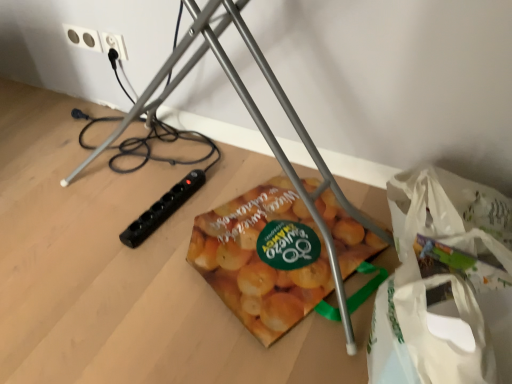
Identify the location of black plastic power plug at upper left, marked as the first power plugs and sockets in a right-to-left arrangement. The height and width of the screenshot is (384, 512). (114, 44).

Image resolution: width=512 pixels, height=384 pixels. In order to click on metallic tripod at center in this screenshot , I will do `click(256, 125)`.

Considering the sizes of objects white plastic power plugs and sockets at upper left, positioned as the 2th power plugs and sockets in right-to-left order, and black plastic power plug at upper left, marked as the first power plugs and sockets in a right-to-left arrangement, in the image provided, who is smaller, white plastic power plugs and sockets at upper left, positioned as the 2th power plugs and sockets in right-to-left order, or black plastic power plug at upper left, marked as the first power plugs and sockets in a right-to-left arrangement,?

Smaller between the two is white plastic power plugs and sockets at upper left, positioned as the 2th power plugs and sockets in right-to-left order.

Which object is positioned more to the left, white plastic power plugs and sockets at upper left, the 1th power plugs and sockets viewed from the left, or black plastic power plug at upper left, acting as the second power plugs and sockets starting from the left?

From the viewer's perspective, white plastic power plugs and sockets at upper left, the 1th power plugs and sockets viewed from the left, appears more on the left side.

Between white plastic power plugs and sockets at upper left, the 1th power plugs and sockets viewed from the left, and black plastic power plug at upper left, acting as the second power plugs and sockets starting from the left, which one has less height?

white plastic power plugs and sockets at upper left, the 1th power plugs and sockets viewed from the left.

Considering the relative sizes of white plastic power plugs and sockets at upper left, the 1th power plugs and sockets viewed from the left, and black plastic power plug at upper left, acting as the second power plugs and sockets starting from the left, in the image provided, is white plastic power plugs and sockets at upper left, the 1th power plugs and sockets viewed from the left, wider than black plastic power plug at upper left, acting as the second power plugs and sockets starting from the left,?

Incorrect, the width of white plastic power plugs and sockets at upper left, the 1th power plugs and sockets viewed from the left, does not surpass that of black plastic power plug at upper left, acting as the second power plugs and sockets starting from the left.

Which is nearer, (110, 38) or (85, 37)?

Clearly, point (110, 38) is closer to the camera than point (85, 37).

Is there a large distance between black plastic power plug at upper left, marked as the first power plugs and sockets in a right-to-left arrangement, and white plastic power plugs and sockets at upper left, the 1th power plugs and sockets viewed from the left?

No, black plastic power plug at upper left, marked as the first power plugs and sockets in a right-to-left arrangement, is not far from white plastic power plugs and sockets at upper left, the 1th power plugs and sockets viewed from the left.

Considering the positions of objects black plastic power plug at upper left, acting as the second power plugs and sockets starting from the left, and white plastic power plugs and sockets at upper left, the 1th power plugs and sockets viewed from the left, in the image provided, who is more to the right, black plastic power plug at upper left, acting as the second power plugs and sockets starting from the left, or white plastic power plugs and sockets at upper left, the 1th power plugs and sockets viewed from the left,?

black plastic power plug at upper left, acting as the second power plugs and sockets starting from the left, is more to the right.

From their relative heights in the image, would you say black plastic power plug at upper left, acting as the second power plugs and sockets starting from the left, is taller or shorter than white plastic power plugs and sockets at upper left, the 1th power plugs and sockets viewed from the left?

In the image, black plastic power plug at upper left, acting as the second power plugs and sockets starting from the left, appears to be taller than white plastic power plugs and sockets at upper left, the 1th power plugs and sockets viewed from the left.

At what (x,y) coordinates should I click in order to perform the action: click on tripod in front of the matte plastic bag of sweet potatoes at center. Please return your answer as a coordinate pair (x, y). Looking at the image, I should click on (256, 125).

Measure the distance from metallic tripod at center to matte plastic bag of sweet potatoes at center.

A distance of 7.91 inches exists between metallic tripod at center and matte plastic bag of sweet potatoes at center.

In terms of width, does metallic tripod at center look wider or thinner when compared to matte plastic bag of sweet potatoes at center?

In the image, metallic tripod at center appears to be wider than matte plastic bag of sweet potatoes at center.

From a real-world perspective, who is located higher, metallic tripod at center or matte plastic bag of sweet potatoes at center?

matte plastic bag of sweet potatoes at center, from a real-world perspective.

From the image's perspective, would you say metallic tripod at center is shown under white plastic power plugs and sockets at upper left, the 1th power plugs and sockets viewed from the left?

Yes.

Is metallic tripod at center oriented away from white plastic power plugs and sockets at upper left, positioned as the 2th power plugs and sockets in right-to-left order?

No.

Where is `tripod lying on the right of white plastic power plugs and sockets at upper left, positioned as the 2th power plugs and sockets in right-to-left order`? The height and width of the screenshot is (384, 512). tripod lying on the right of white plastic power plugs and sockets at upper left, positioned as the 2th power plugs and sockets in right-to-left order is located at coordinates (256, 125).

Can you confirm if metallic tripod at center is shorter than white plastic power plugs and sockets at upper left, positioned as the 2th power plugs and sockets in right-to-left order?

Yes, metallic tripod at center is shorter than white plastic power plugs and sockets at upper left, positioned as the 2th power plugs and sockets in right-to-left order.

From the image's perspective, is white plastic power plugs and sockets at upper left, positioned as the 2th power plugs and sockets in right-to-left order, above or below matte plastic bag of sweet potatoes at center?

Clearly, from the image's perspective, white plastic power plugs and sockets at upper left, positioned as the 2th power plugs and sockets in right-to-left order, is above matte plastic bag of sweet potatoes at center.

Is white plastic power plugs and sockets at upper left, positioned as the 2th power plugs and sockets in right-to-left order, with matte plastic bag of sweet potatoes at center?

No, white plastic power plugs and sockets at upper left, positioned as the 2th power plugs and sockets in right-to-left order, is not touching matte plastic bag of sweet potatoes at center.

Considering the points (77, 31) and (331, 278), which point is behind, point (77, 31) or point (331, 278)?

Point (77, 31)

In terms of size, does white plastic power plugs and sockets at upper left, the 1th power plugs and sockets viewed from the left, appear bigger or smaller than matte plastic bag of sweet potatoes at center?

In the image, white plastic power plugs and sockets at upper left, the 1th power plugs and sockets viewed from the left, appears to be smaller than matte plastic bag of sweet potatoes at center.

Based on their sizes in the image, would you say white plastic bag at lower right is bigger or smaller than metallic tripod at center?

white plastic bag at lower right is smaller than metallic tripod at center.

Who is shorter, white plastic bag at lower right or metallic tripod at center?

metallic tripod at center is shorter.

Is white plastic bag at lower right touching metallic tripod at center?

No, white plastic bag at lower right is not touching metallic tripod at center.

From the image's perspective, is white plastic power plugs and sockets at upper left, the 1th power plugs and sockets viewed from the left, positioned above or below metallic tripod at center?

white plastic power plugs and sockets at upper left, the 1th power plugs and sockets viewed from the left, is situated higher than metallic tripod at center in the image.

Choose the correct answer: Is white plastic power plugs and sockets at upper left, the 1th power plugs and sockets viewed from the left, inside metallic tripod at center or outside it?

white plastic power plugs and sockets at upper left, the 1th power plugs and sockets viewed from the left, is spatially situated outside metallic tripod at center.

Between white plastic power plugs and sockets at upper left, positioned as the 2th power plugs and sockets in right-to-left order, and metallic tripod at center, which one has more height?

With more height is white plastic power plugs and sockets at upper left, positioned as the 2th power plugs and sockets in right-to-left order.

Where is `power plugs and sockets that appears above the black plastic power plug at upper left, acting as the second power plugs and sockets starting from the left (from the image's perspective)`? power plugs and sockets that appears above the black plastic power plug at upper left, acting as the second power plugs and sockets starting from the left (from the image's perspective) is located at coordinates (82, 37).

Identify the location of power plugs and sockets beneath the black plastic power plug at upper left, marked as the first power plugs and sockets in a right-to-left arrangement (from a real-world perspective). Image resolution: width=512 pixels, height=384 pixels. (82, 37).

Estimate the real-world distances between objects in this image. Which object is closer to black plastic power plug at upper left, marked as the first power plugs and sockets in a right-to-left arrangement, matte plastic bag of sweet potatoes at center or white plastic power plugs and sockets at upper left, the 1th power plugs and sockets viewed from the left?

white plastic power plugs and sockets at upper left, the 1th power plugs and sockets viewed from the left.

Estimate the real-world distances between objects in this image. Which object is further from white plastic power plugs and sockets at upper left, the 1th power plugs and sockets viewed from the left, matte plastic bag of sweet potatoes at center or black plastic power plug at upper left, marked as the first power plugs and sockets in a right-to-left arrangement?

matte plastic bag of sweet potatoes at center is further to white plastic power plugs and sockets at upper left, the 1th power plugs and sockets viewed from the left.

Based on their spatial positions, is matte plastic bag of sweet potatoes at center or black plastic power plug at upper left, marked as the first power plugs and sockets in a right-to-left arrangement, further from metallic tripod at center?

black plastic power plug at upper left, marked as the first power plugs and sockets in a right-to-left arrangement.

From the image, which object appears to be farther from white plastic bag at lower right, white plastic power plugs and sockets at upper left, the 1th power plugs and sockets viewed from the left, or matte plastic bag of sweet potatoes at center?

Among the two, white plastic power plugs and sockets at upper left, the 1th power plugs and sockets viewed from the left, is located further to white plastic bag at lower right.

Which object lies nearer to the anchor point white plastic power plugs and sockets at upper left, positioned as the 2th power plugs and sockets in right-to-left order, white plastic bag at lower right or matte plastic bag of sweet potatoes at center?

matte plastic bag of sweet potatoes at center is positioned closer to the anchor white plastic power plugs and sockets at upper left, positioned as the 2th power plugs and sockets in right-to-left order.

Which object lies nearer to the anchor point black plastic power plug at upper left, marked as the first power plugs and sockets in a right-to-left arrangement, matte plastic bag of sweet potatoes at center or white plastic bag at lower right?

Based on the image, matte plastic bag of sweet potatoes at center appears to be nearer to black plastic power plug at upper left, marked as the first power plugs and sockets in a right-to-left arrangement.

When comparing their distances from white plastic power plugs and sockets at upper left, the 1th power plugs and sockets viewed from the left, does black plastic power plug at upper left, marked as the first power plugs and sockets in a right-to-left arrangement, or matte plastic bag of sweet potatoes at center seem further?

matte plastic bag of sweet potatoes at center lies further to white plastic power plugs and sockets at upper left, the 1th power plugs and sockets viewed from the left, than the other object.

Which object lies nearer to the anchor point white plastic bag at lower right, white plastic power plugs and sockets at upper left, positioned as the 2th power plugs and sockets in right-to-left order, or metallic tripod at center?

metallic tripod at center.

The height and width of the screenshot is (384, 512). I want to click on tripod between white plastic power plugs and sockets at upper left, the 1th power plugs and sockets viewed from the left, and white plastic bag at lower right, so click(256, 125).

Where is `power plugs and sockets located between metallic tripod at center and white plastic power plugs and sockets at upper left, the 1th power plugs and sockets viewed from the left, in the depth direction`? power plugs and sockets located between metallic tripod at center and white plastic power plugs and sockets at upper left, the 1th power plugs and sockets viewed from the left, in the depth direction is located at coordinates (114, 44).

Locate an element on the screen. snack between metallic tripod at center and white plastic bag at lower right is located at coordinates 259,260.

The width and height of the screenshot is (512, 384). Identify the location of tripod situated between white plastic power plugs and sockets at upper left, the 1th power plugs and sockets viewed from the left, and matte plastic bag of sweet potatoes at center from left to right. (256, 125).